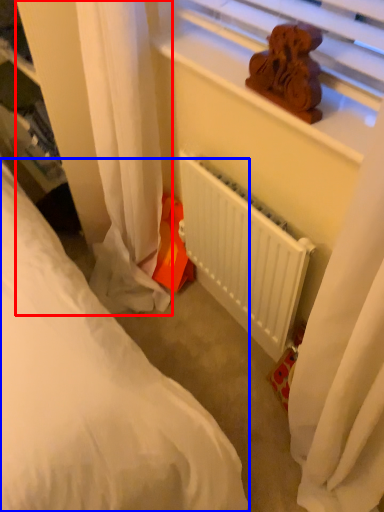
Question: Which object appears farthest to the camera in this image, curtain (highlighted by a red box) or bed (highlighted by a blue box)?

Choices:
 (A) curtain
 (B) bed

Answer: (B)